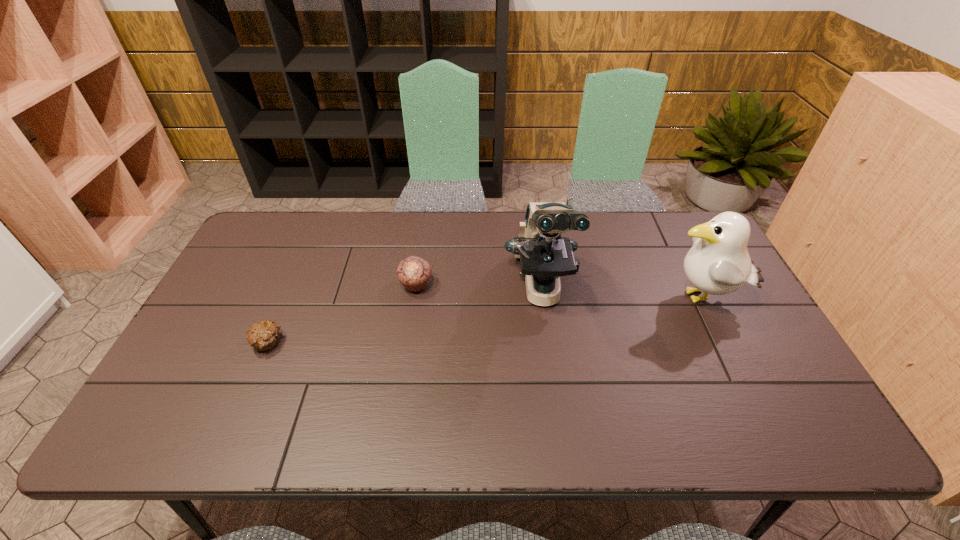
Locate which object is the third closest to the taller muffin. Please provide its 2D coordinates. Your answer should be formatted as a tuple, i.e. [(x, y)], where the tuple contains the x and y coordinates of a point satisfying the conditions above.

[(718, 263)]

Locate an element on the screen. vacant region that satisfies the following two spatial constraints: 1. on the back side of the nearer muffin; 2. on the left side of the third object from right to left is located at coordinates (293, 285).

At what (x,y) coordinates should I click in order to perform the action: click on vacant space that satisfies the following two spatial constraints: 1. on the back side of the taller muffin; 2. on the right side of the shortest object. Please return your answer as a coordinate pair (x, y). The height and width of the screenshot is (540, 960). Looking at the image, I should click on (293, 285).